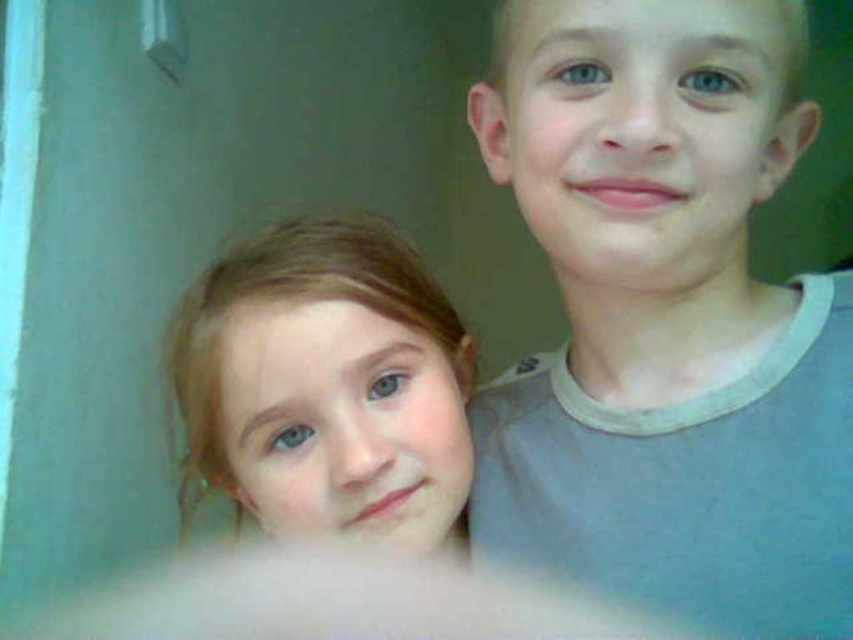
Question: Which point appears farthest from the camera in this image?

Choices:
 (A) pos(561,182)
 (B) pos(355,428)

Answer: (B)

Question: Can you confirm if gray cotton shirt at right is bigger than smooth blonde hair at lower left?

Choices:
 (A) yes
 (B) no

Answer: (A)

Question: Among these points, which one is nearest to the camera?

Choices:
 (A) (717, 257)
 (B) (422, 339)

Answer: (A)

Question: Can you confirm if gray cotton shirt at right is thinner than smooth blonde hair at lower left?

Choices:
 (A) no
 (B) yes

Answer: (A)

Question: Can you confirm if gray cotton shirt at right is positioned to the right of smooth blonde hair at lower left?

Choices:
 (A) no
 (B) yes

Answer: (B)